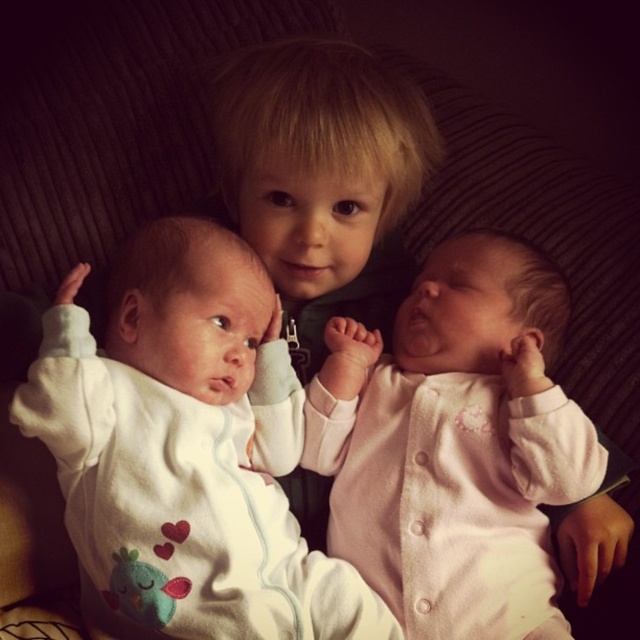
You are a photographer arranging three children for a family photo. The two infants are wearing white soft onesie at center and pink matte onesie at center. Based on the scene description, which infant is positioned lower in the image?

The white soft onesie at center is below the pink matte onesie at center, so the infant wearing the white soft onesie at center is positioned lower in the image.

In the image, there are two infants wearing the white soft onesie at center and the pink matte onesie at center. Which infant is wearing the taller onesie?

The white soft onesie at center is much taller than the pink matte onesie at center.

You are a photographer adjusting the lighting for a family photo. You need to ensure the white soft onesie at center and the blonde hair at center are both well lit. Given their distance apart, can you illuminate both subjects evenly without moving the lights?

The distance between the white soft onesie at center and the blonde hair at center is 8.11 inches, which is close enough to ensure even lighting with proper placement of the light sources. Adjust the lights to cover this small area effectively.